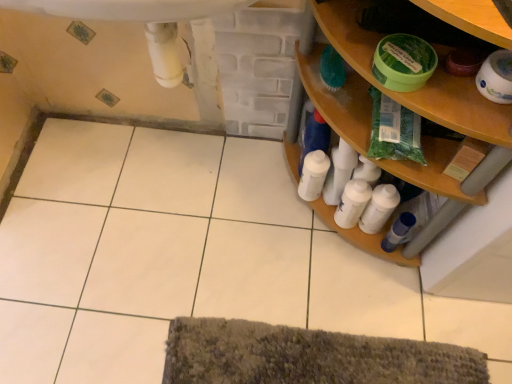
This screenshot has width=512, height=384. Find the location of `vacant space in white plastic sink at upper center (from a real-world perspective)`. vacant space in white plastic sink at upper center (from a real-world perspective) is located at coordinates (195, 223).